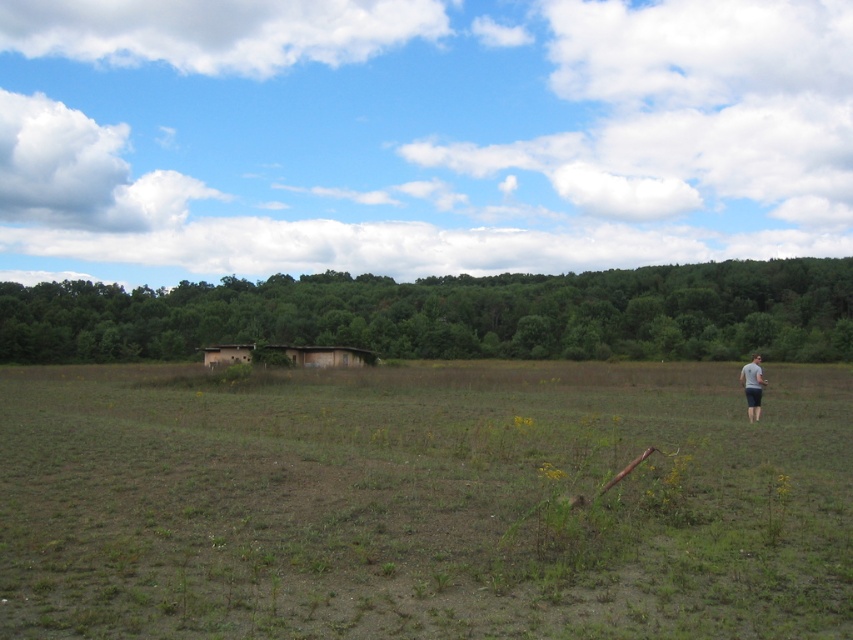
You are standing in the open field and see the brown dry grass at center and the brown wooden hut at center. Which object is located to the right of the other?

The brown dry grass at center is positioned on the right side of brown wooden hut at center.